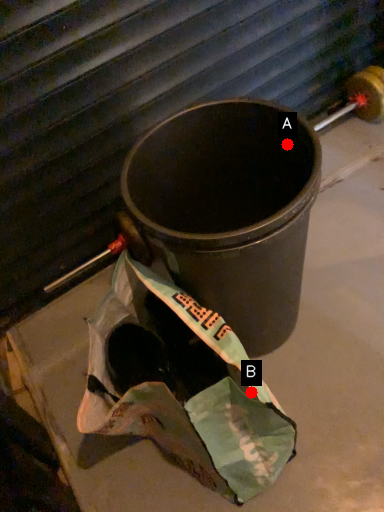
Question: Two points are circled on the image, labeled by A and B beside each circle. Which point is closer to the camera?

Choices:
 (A) A is closer
 (B) B is closer

Answer: (B)